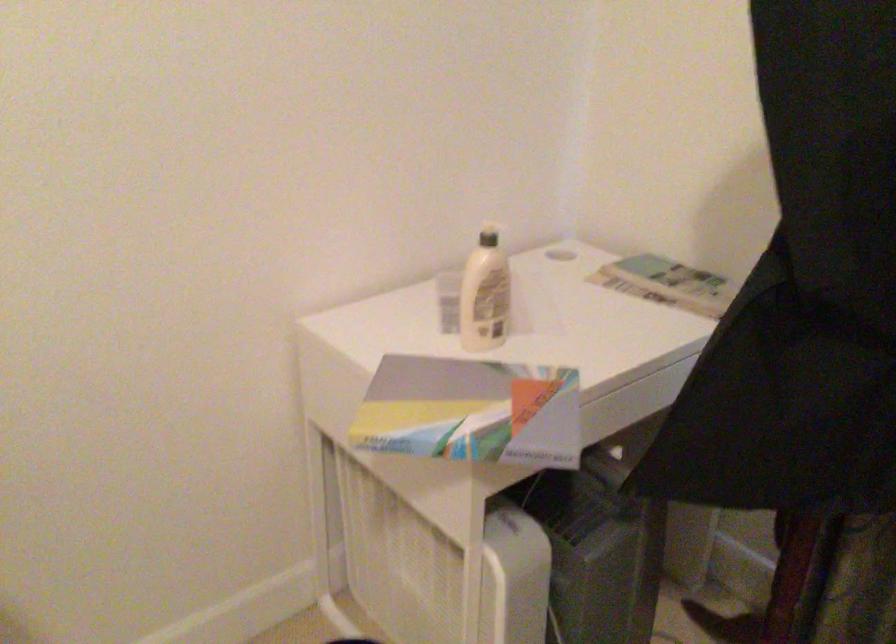
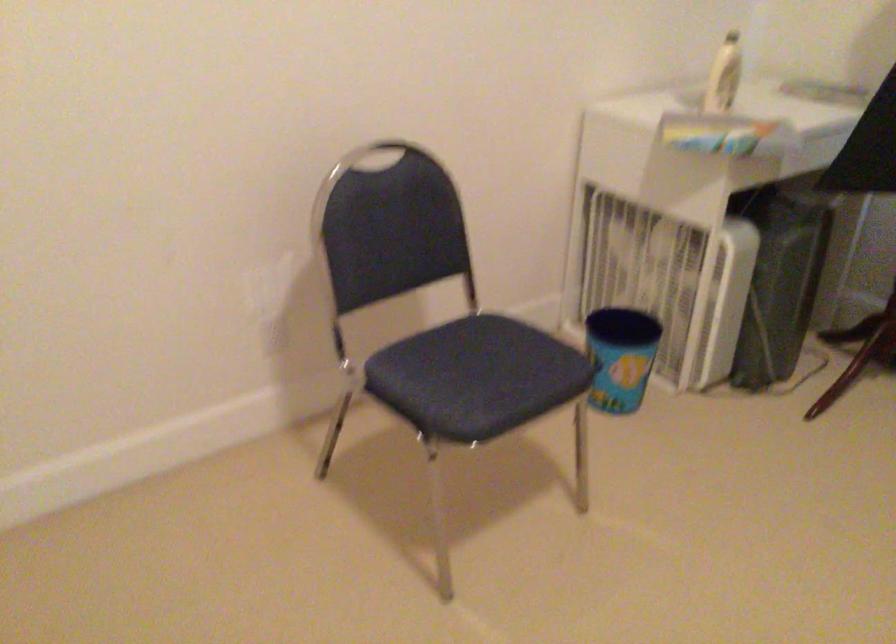
Find the pixel in the second image that matches point 483,301 in the first image.

(724, 76)